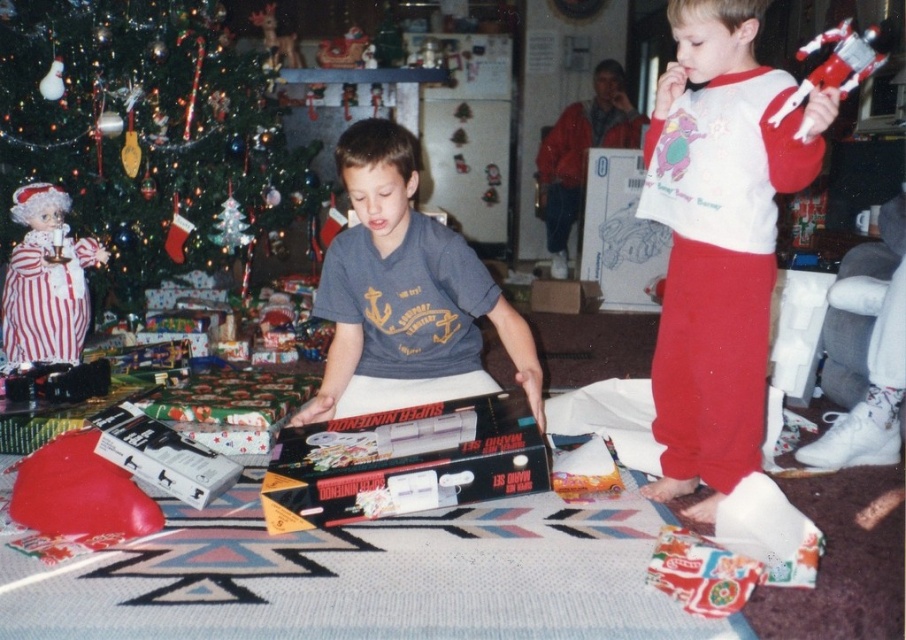
Question: Based on their relative distances, which object is farther from the red plastic robot at upper right?

Choices:
 (A) black matte donkey kong game at center
 (B) striped fabric clown at left

Answer: (B)

Question: Does striped fabric clown at left have a lesser width compared to white matte video game console at lower left?

Choices:
 (A) yes
 (B) no

Answer: (B)

Question: Is green matte christmas tree at upper left below white matte video game console at lower left?

Choices:
 (A) no
 (B) yes

Answer: (A)

Question: Which point is closer to the camera taking this photo?

Choices:
 (A) (288, 218)
 (B) (849, 60)
 (C) (74, 307)

Answer: (B)

Question: Does black matte donkey kong game at center appear under red plastic robot at upper right?

Choices:
 (A) yes
 (B) no

Answer: (A)

Question: Which point is farther to the camera?

Choices:
 (A) striped fabric clown at left
 (B) white matte video game console at lower left
 (C) red plastic robot at upper right

Answer: (A)